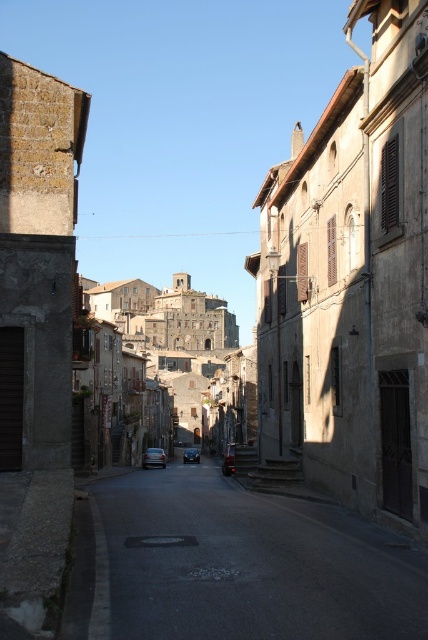
You are a delivery driver trying to navigate a narrow street in a historic European town. You see a shiny silver car at center and a shiny black sedan at center. Which car should you avoid to make a safe passage through the street?

The shiny silver car at center is positioned on the left side of the shiny black sedan at center. To make a safe passage through the street, you should avoid the shiny silver car at center and navigate around the shiny black sedan at center since it is positioned further to the right, allowing more space for maneuvering in the narrow street.

You are driving a shiny black sedan at center and want to park it in a spot that can accommodate its size. Given the presence of the stone castle at center, can you park your car there?

The stone castle at center is bigger than the shiny black sedan at center, but since the castle is a stationary structure and not a parking space, you cannot park your car there. Look for an appropriate parking area instead.

You are a tour guide leading a group down the narrow street. You want to show them the stone castle at center and the shiny black sedan at center. Which object is higher up in the image?

The stone castle at center is positioned over the shiny black sedan at center, so it is higher up in the image.